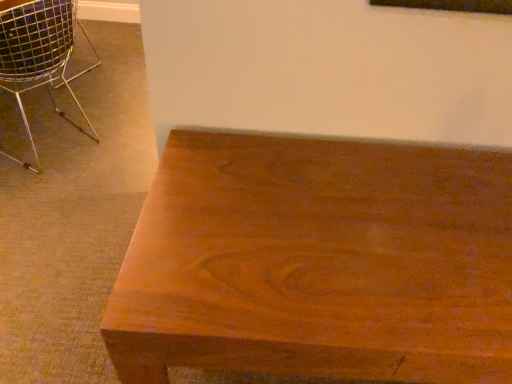
At what (x,y) coordinates should I click in order to perform the action: click on vacant area that lies to the right of metallic wire chair at left. Please return your answer as a coordinate pair (x, y). The height and width of the screenshot is (384, 512). Looking at the image, I should click on (119, 149).